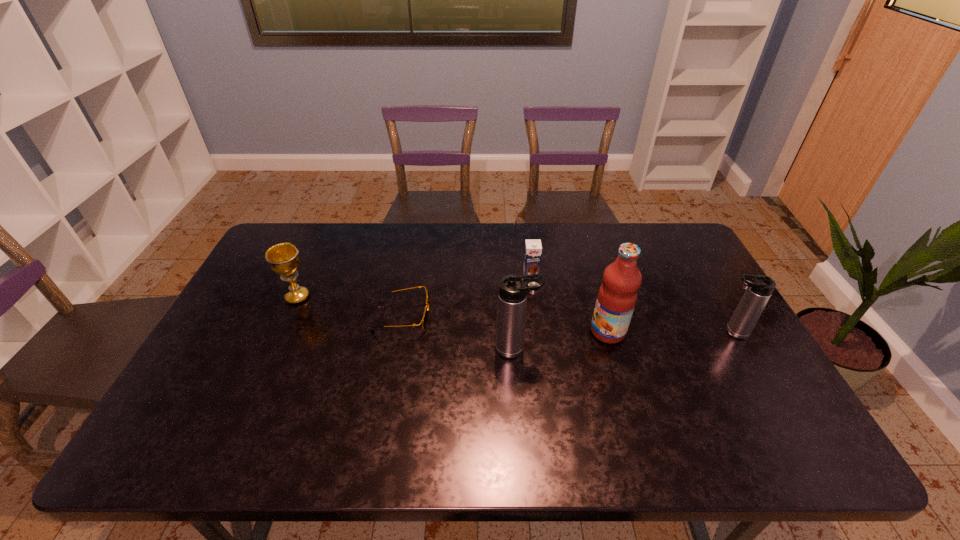
The width and height of the screenshot is (960, 540). Identify the location of object at the left edge. (283, 258).

You are a GUI agent. You are given a task and a screenshot of the screen. Output one action in this format:
    pyautogui.click(x=<x>, y=<y>)
    Task: Click on the object situated at the right edge
    Image resolution: width=960 pixels, height=540 pixels.
    Given the screenshot: What is the action you would take?
    pyautogui.click(x=759, y=288)

The height and width of the screenshot is (540, 960). Find the location of `free location at the far edge of the desktop`. free location at the far edge of the desktop is located at coordinates (609, 248).

I want to click on vacant space at the near edge of the desktop, so click(344, 401).

Where is `blank space at the left edge`? This screenshot has width=960, height=540. blank space at the left edge is located at coordinates (227, 315).

In the image, there is a desktop. Where is `vacant space at the right edge`? vacant space at the right edge is located at coordinates (702, 317).

The height and width of the screenshot is (540, 960). In the image, there is a desktop. Find the location of `vacant space at the far right corner`. vacant space at the far right corner is located at coordinates (662, 241).

In the image, there is a desktop. In order to click on vacant space at the near right corner in this screenshot , I will do `click(769, 412)`.

You are a GUI agent. You are given a task and a screenshot of the screen. Output one action in this format:
    pyautogui.click(x=<x>, y=<y>)
    Task: Click on the free space between the fifth object from right to left and the shorter thermos bottle
    
    Given the screenshot: What is the action you would take?
    pyautogui.click(x=566, y=325)

The height and width of the screenshot is (540, 960). In order to click on vacant area that lies between the second object from right to left and the taller thermos bottle in this screenshot , I will do `click(562, 340)`.